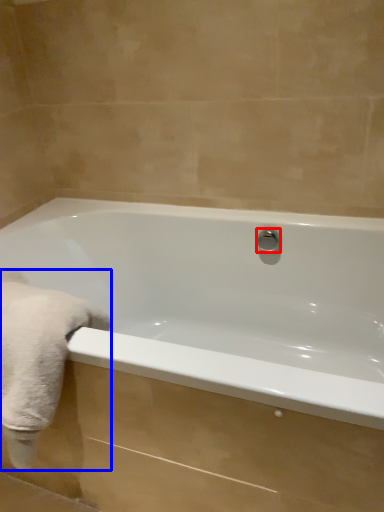
Question: Which object appears closest to the camera in this image, shower (highlighted by a red box) or bath towel (highlighted by a blue box)?

Choices:
 (A) shower
 (B) bath towel

Answer: (B)